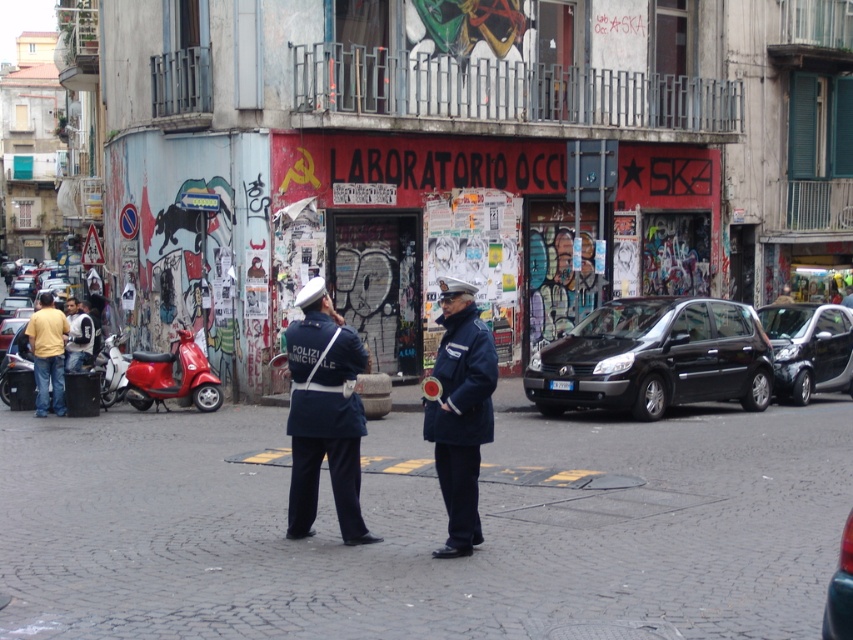
Looking at this image, you are a photographer trying to capture both the yellow cotton shirt at left and the light brown leather jacket at center in a single frame. Considering their widths, which one should you position closer to the camera to ensure both fit in the frame?

The yellow cotton shirt at left might be wider than light brown leather jacket at center, so positioning the yellow cotton shirt at left closer to the camera would help ensure both fit within the frame.

You are a pedestrian standing at the center of the street. You see a shiny black car at right and a light blue denim jacket at left. Which object is positioned lower in the scene?

The shiny black car at right is below the light blue denim jacket at left, so the shiny black car at right is positioned lower in the scene.

You are a tailor who needs to determine which clothing item requires more fabric to repair. You have the navy blue fabric uniform at center and the dark blue fabric jacket at center. Which one needs more fabric?

The navy blue fabric uniform at center requires more fabric for repair since it is bigger than the dark blue fabric jacket at center.